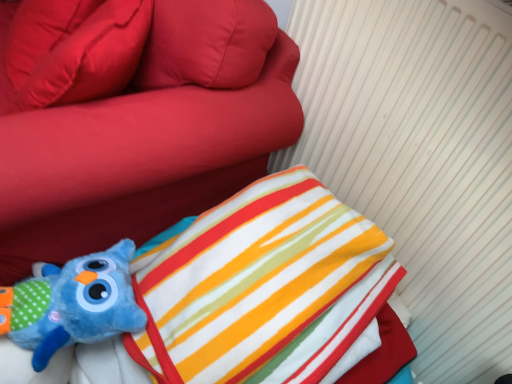
Find the location of a particular element. Image resolution: width=512 pixels, height=384 pixels. soft plush toy at lower left is located at coordinates (150, 137).

What are the coordinates of `matte red pillow at upper left` in the screenshot? It's located at (74, 49).

Which is correct: matte red pillow at upper left is inside soft plush toy at lower left, or outside of it?

matte red pillow at upper left is located inside soft plush toy at lower left.

Are matte red pillow at upper left and soft plush toy at lower left beside each other?

No, matte red pillow at upper left is not making contact with soft plush toy at lower left.

Is matte red pillow at upper left to the left or to the right of soft plush toy at lower left in the image?

Based on their positions, matte red pillow at upper left is located to the right of soft plush toy at lower left.

Is blue plush toy at lower left next to matte red pillow at upper left?

No, blue plush toy at lower left is not beside matte red pillow at upper left.

From a real-world perspective, relative to matte red pillow at upper left, is blue plush toy at lower left vertically above or below?

blue plush toy at lower left is situated lower than matte red pillow at upper left in the real world.

Looking at this image, between blue plush toy at lower left and matte red pillow at upper left, which one appears on the left side from the viewer's perspective?

matte red pillow at upper left.

How many degrees apart are the facing directions of blue plush toy at lower left and matte red pillow at upper left?

They differ by 14.7 degrees in their facing directions.

Is point (59, 99) closer or farther from the camera than point (37, 293)?

Clearly, point (59, 99) is more distant from the camera than point (37, 293).

Considering the relative sizes of matte red pillow at upper left and blue plush toy at lower left in the image provided, is matte red pillow at upper left taller than blue plush toy at lower left?

Yes, matte red pillow at upper left is taller than blue plush toy at lower left.

Consider the image. From the image's perspective, is matte red pillow at upper left over blue plush toy at lower left?

Yes, from the image's perspective, matte red pillow at upper left is on top of blue plush toy at lower left.

Is soft plush toy at lower left inside the boundaries of blue plush toy at lower left, or outside?

soft plush toy at lower left is located beyond the bounds of blue plush toy at lower left.

Considering the relative sizes of soft plush toy at lower left and blue plush toy at lower left in the image provided, is soft plush toy at lower left bigger than blue plush toy at lower left?

Correct, soft plush toy at lower left is larger in size than blue plush toy at lower left.

From a real-world perspective, is soft plush toy at lower left located beneath blue plush toy at lower left?

Indeed, from a real-world perspective, soft plush toy at lower left is positioned beneath blue plush toy at lower left.

Is point (23, 213) more distant than point (89, 281)?

Yes, point (23, 213) is behind point (89, 281).

Considering the sizes of objects blue plush toy at lower left and soft plush toy at lower left in the image provided, who is shorter, blue plush toy at lower left or soft plush toy at lower left?

blue plush toy at lower left.

Considering the positions of point (42, 323) and point (218, 135), is point (42, 323) closer or farther from the camera than point (218, 135)?

Clearly, point (42, 323) is closer to the camera than point (218, 135).

Is blue plush toy at lower left spatially inside soft plush toy at lower left, or outside of it?

blue plush toy at lower left is outside soft plush toy at lower left.

In the image, is blue plush toy at lower left on the left side or the right side of soft plush toy at lower left?

Clearly, blue plush toy at lower left is on the right of soft plush toy at lower left in the image.

Is soft plush toy at lower left bigger than matte red pillow at upper left?

Correct, soft plush toy at lower left is larger in size than matte red pillow at upper left.

Is soft plush toy at lower left spatially inside matte red pillow at upper left, or outside of it?

soft plush toy at lower left is located beyond the bounds of matte red pillow at upper left.

From the image's perspective, which one is positioned higher, soft plush toy at lower left or matte red pillow at upper left?

From the image's view, soft plush toy at lower left is above.

Can you confirm if soft plush toy at lower left is positioned to the left of matte red pillow at upper left?

Yes, soft plush toy at lower left is to the left of matte red pillow at upper left.

This screenshot has height=384, width=512. I want to click on furniture above the matte red pillow at upper left (from the image's perspective), so click(x=150, y=137).

This screenshot has width=512, height=384. I want to click on toy in front of the matte red pillow at upper left, so click(x=74, y=304).

Which object lies nearer to the anchor point soft plush toy at lower left, matte red pillow at upper left or blue plush toy at lower left?

The object closer to soft plush toy at lower left is matte red pillow at upper left.

Based on their spatial positions, is soft plush toy at lower left or matte red pillow at upper left further from blue plush toy at lower left?

matte red pillow at upper left lies further to blue plush toy at lower left than the other object.

When comparing their distances from soft plush toy at lower left, does blue plush toy at lower left or matte red pillow at upper left seem closer?

Based on the image, matte red pillow at upper left appears to be nearer to soft plush toy at lower left.

Based on their spatial positions, is soft plush toy at lower left or blue plush toy at lower left further from matte red pillow at upper left?

blue plush toy at lower left lies further to matte red pillow at upper left than the other object.

Based on their spatial positions, is matte red pillow at upper left or soft plush toy at lower left further from blue plush toy at lower left?

matte red pillow at upper left lies further to blue plush toy at lower left than the other object.

When comparing their distances from matte red pillow at upper left, does blue plush toy at lower left or soft plush toy at lower left seem closer?

soft plush toy at lower left is positioned closer to the anchor matte red pillow at upper left.

Find the location of a particular element. The image size is (512, 384). pillow between soft plush toy at lower left and blue plush toy at lower left in the up-down direction is located at coordinates (74, 49).